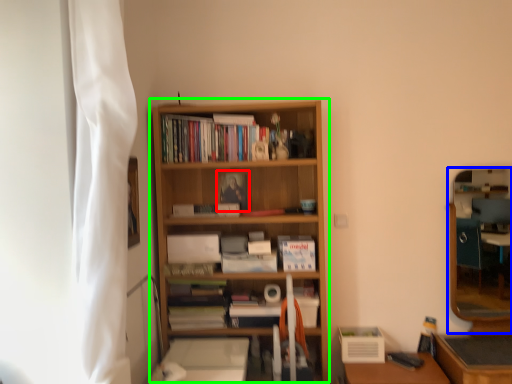
Question: Which is nearer to the paperback book (highlighted by a red box)? mirror (highlighted by a blue box) or bookcase (highlighted by a green box).

Choices:
 (A) mirror
 (B) bookcase

Answer: (B)